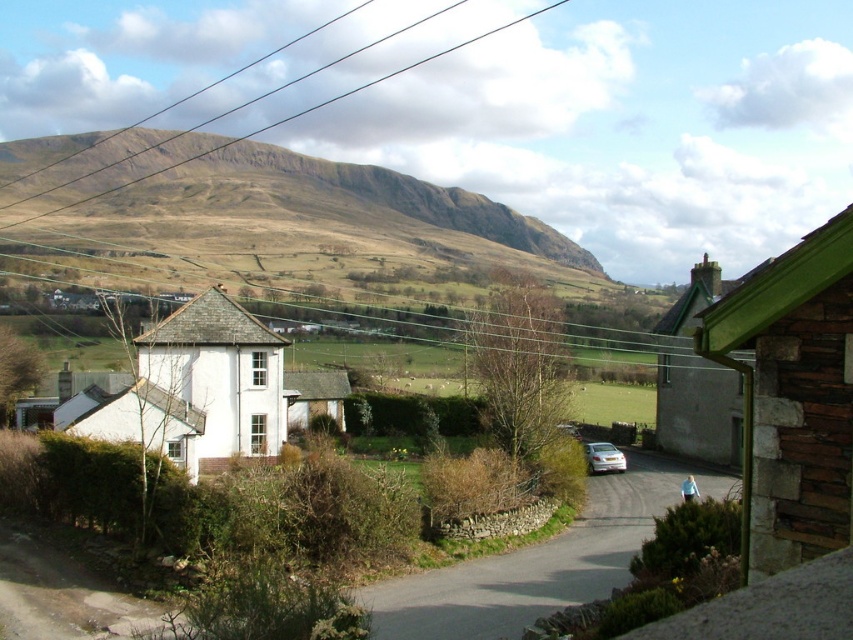
Who is taller, white smooth house at center or green wooden cottage at upper right?

With more height is green wooden cottage at upper right.

Who is higher up, white smooth house at center or green wooden cottage at upper right?

green wooden cottage at upper right

Is point (270, 449) farther from camera compared to point (668, 337)?

No, (270, 449) is closer to viewer.

I want to click on white smooth house at center, so click(x=219, y=376).

Which is behind, point (706, 451) or point (99, 196)?

The point (99, 196) is behind.

Which is behind, point (683, 419) or point (67, 209)?

Point (67, 209)

In order to click on green wooden cottage at upper right in this screenshot , I will do `click(695, 378)`.

Which is below, smooth wire at upper center or silver metallic car at center?

Positioned lower is silver metallic car at center.

This screenshot has width=853, height=640. Identify the location of smooth wire at upper center. (294, 113).

You are a GUI agent. You are given a task and a screenshot of the screen. Output one action in this format:
    pyautogui.click(x=<x>, y=<y>)
    Task: Click on the smooth wire at upper center
    
    Given the screenshot: What is the action you would take?
    pyautogui.click(x=294, y=113)

Locate an element on the screen. The image size is (853, 640). smooth wire at upper center is located at coordinates (294, 113).